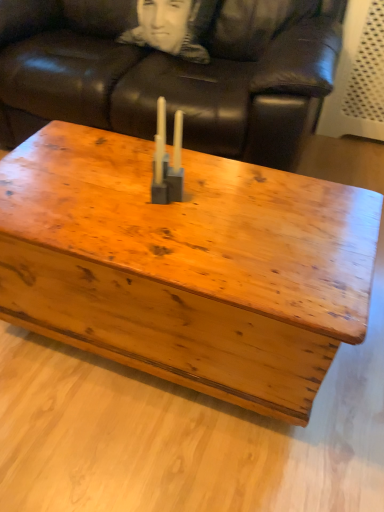
Question: Does brown leather couch at upper center appear on the left side of matte gray plastic candle holder at center?

Choices:
 (A) no
 (B) yes

Answer: (B)

Question: Does brown leather couch at upper center come behind matte gray plastic candle holder at center?

Choices:
 (A) yes
 (B) no

Answer: (A)

Question: Does brown leather couch at upper center have a greater width compared to matte gray plastic candle holder at center?

Choices:
 (A) yes
 (B) no

Answer: (A)

Question: Can you confirm if brown leather couch at upper center is smaller than matte gray plastic candle holder at center?

Choices:
 (A) no
 (B) yes

Answer: (A)

Question: Is brown leather couch at upper center aimed at matte gray plastic candle holder at center?

Choices:
 (A) no
 (B) yes

Answer: (B)

Question: Considering their positions, is brown leather couch at upper center located in front of or behind matte gray plastic candle holder at center?

Choices:
 (A) behind
 (B) front

Answer: (A)

Question: From a real-world perspective, is brown leather couch at upper center positioned above or below matte gray plastic candle holder at center?

Choices:
 (A) below
 (B) above

Answer: (A)

Question: Is brown leather couch at upper center inside the boundaries of matte gray plastic candle holder at center, or outside?

Choices:
 (A) inside
 (B) outside

Answer: (B)

Question: From the image's perspective, relative to matte gray plastic candle holder at center, is brown leather couch at upper center above or below?

Choices:
 (A) below
 (B) above

Answer: (B)

Question: Is wooden coffee table at center bigger or smaller than brown leather couch at upper center?

Choices:
 (A) big
 (B) small

Answer: (B)

Question: From a real-world perspective, relative to brown leather couch at upper center, is wooden coffee table at center vertically above or below?

Choices:
 (A) above
 (B) below

Answer: (B)

Question: Considering the relative positions of wooden coffee table at center and brown leather couch at upper center in the image provided, is wooden coffee table at center to the left or to the right of brown leather couch at upper center?

Choices:
 (A) right
 (B) left

Answer: (A)

Question: Is point (289, 246) positioned closer to the camera than point (100, 90)?

Choices:
 (A) farther
 (B) closer

Answer: (B)

Question: In terms of width, does black fabric pillow at upper center look wider or thinner when compared to brown leather couch at upper center?

Choices:
 (A) wide
 (B) thin

Answer: (B)

Question: Would you say black fabric pillow at upper center is inside or outside brown leather couch at upper center?

Choices:
 (A) outside
 (B) inside

Answer: (B)